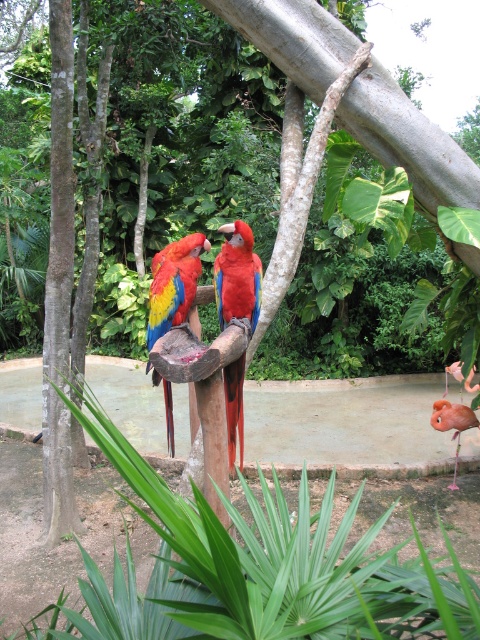
Does shiny red parrot at center have a greater height compared to shiny multicolored parrot at center?

Indeed, shiny red parrot at center has a greater height compared to shiny multicolored parrot at center.

Does shiny red parrot at center have a greater width compared to shiny multicolored parrot at center?

Incorrect, shiny red parrot at center's width does not surpass shiny multicolored parrot at center's.

Does point (240, 424) come in front of point (156, 320)?

Yes, it is in front of point (156, 320).

I want to click on shiny red parrot at center, so click(x=238, y=276).

Does shiny red parrot at center appear on the left side of matte pink flamingo at lower right?

Indeed, shiny red parrot at center is positioned on the left side of matte pink flamingo at lower right.

At what (x,y) coordinates should I click in order to perform the action: click on shiny red parrot at center. Please return your answer as a coordinate pair (x, y). The image size is (480, 640). Looking at the image, I should click on (238, 276).

Is shiny multicolored parrot at center above matte pink flamingo at lower right?

Indeed, shiny multicolored parrot at center is positioned over matte pink flamingo at lower right.

Between shiny multicolored parrot at center and matte pink flamingo at lower right, which one is positioned higher?

Positioned higher is shiny multicolored parrot at center.

Is point (170, 388) in front of point (432, 426)?

Yes, it is.

Identify the location of shiny multicolored parrot at center. Image resolution: width=480 pixels, height=640 pixels. (173, 284).